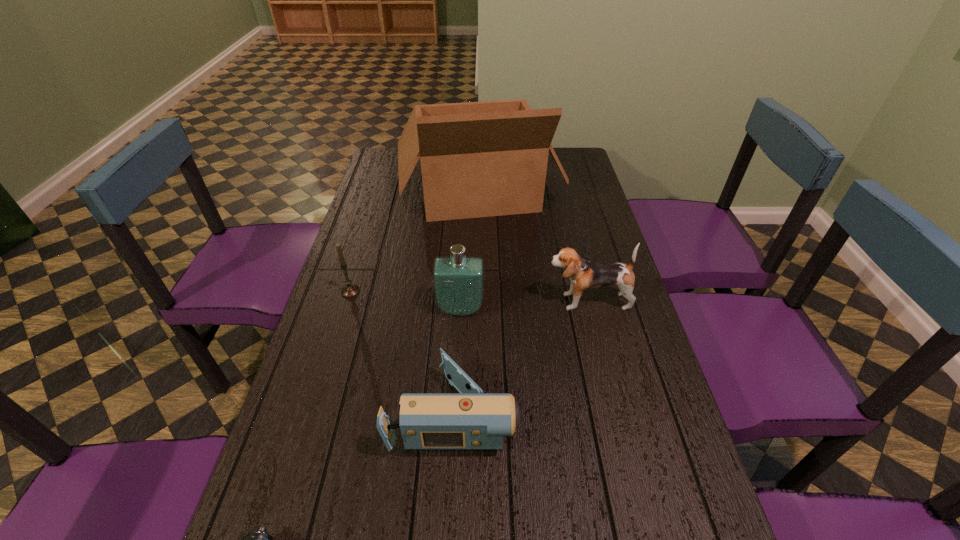
I want to click on vacant space located at the face of the puppy, so click(519, 301).

Locate an element on the screen. The image size is (960, 540). vacant area situated 0.090m on the back of the candle is located at coordinates (358, 265).

This screenshot has height=540, width=960. I want to click on free space located on the side of the camcorder with the flip-out screen, so pyautogui.click(x=646, y=413).

Find the location of a particular element. This screenshot has height=540, width=960. object located at the far edge is located at coordinates (478, 159).

Identify the location of box present at the left edge. The height and width of the screenshot is (540, 960). (478, 159).

You are a GUI agent. You are given a task and a screenshot of the screen. Output one action in this format:
    pyautogui.click(x=<x>, y=<y>)
    Task: Click on the candle that is at the left edge
    
    Given the screenshot: What is the action you would take?
    pyautogui.click(x=350, y=290)

The height and width of the screenshot is (540, 960). I want to click on box present at the right edge, so click(478, 159).

At what (x,y) coordinates should I click in order to perform the action: click on puppy that is at the right edge. Please return your answer as a coordinate pair (x, y). Looking at the image, I should click on (584, 275).

Locate an element on the screen. Image resolution: width=960 pixels, height=540 pixels. object that is at the far left corner is located at coordinates (478, 159).

Locate an element on the screen. This screenshot has height=540, width=960. object present at the far right corner is located at coordinates (478, 159).